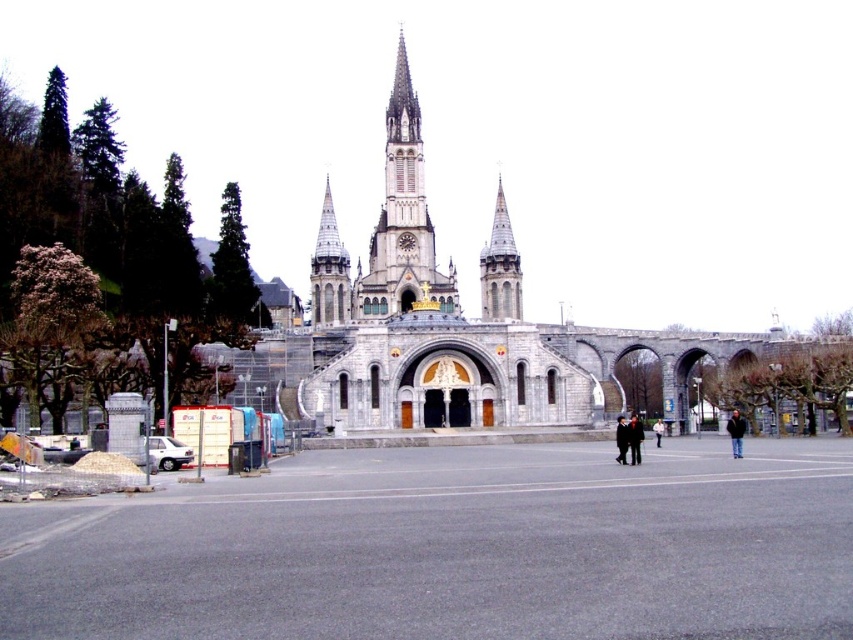
You are standing in the plaza in front of the historic church. You see a black leather jacket at center and a dark gray suit at center. Which one is positioned to the right side?

The black leather jacket at center is to the right of the dark gray suit at center.